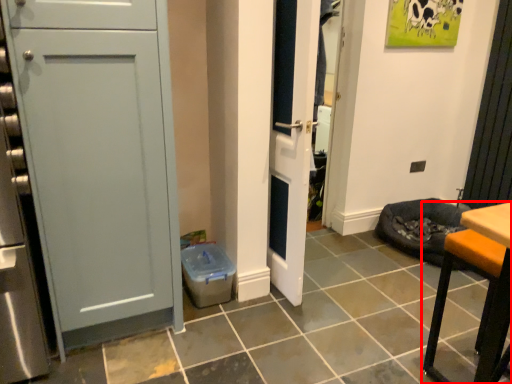
Question: From the image's perspective, considering the relative positions of furniture (annotated by the red box) and door in the image provided, where is furniture (annotated by the red box) located with respect to the staircase?

Choices:
 (A) below
 (B) above

Answer: (A)